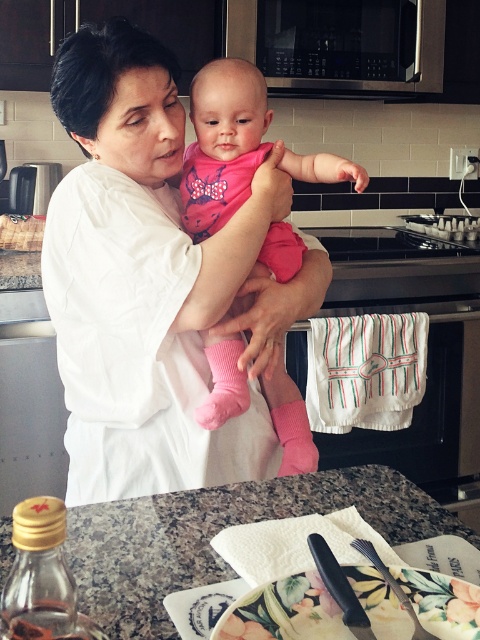
Does granite countertop at center have a greater height compared to pink fabric baby at center?

No.

Consider the image. Is granite countertop at center shorter than pink fabric baby at center?

Yes, granite countertop at center is shorter than pink fabric baby at center.

Does point (127, 545) come farther from viewer compared to point (188, 212)?

No.

The image size is (480, 640). Find the location of `granite countertop at center`. granite countertop at center is located at coordinates (216, 532).

Does white matte shirt at center have a greater width compared to pink fabric baby at center?

Indeed, white matte shirt at center has a greater width compared to pink fabric baby at center.

Is point (80, 173) less distant than point (328, 161)?

Yes.

Is point (116, 188) in front of point (193, 113)?

That is True.

This screenshot has height=640, width=480. What are the coordinates of `white matte shirt at center` in the screenshot? It's located at (143, 280).

Is granite countertop at center shorter than black plastic fork at lower center?

No, granite countertop at center is not shorter than black plastic fork at lower center.

How distant is granite countertop at center from black plastic fork at lower center?

5.97 inches

Is point (311, 484) more distant than point (428, 620)?

Yes, it is.

Where is `granite countertop at center`? granite countertop at center is located at coordinates (216, 532).